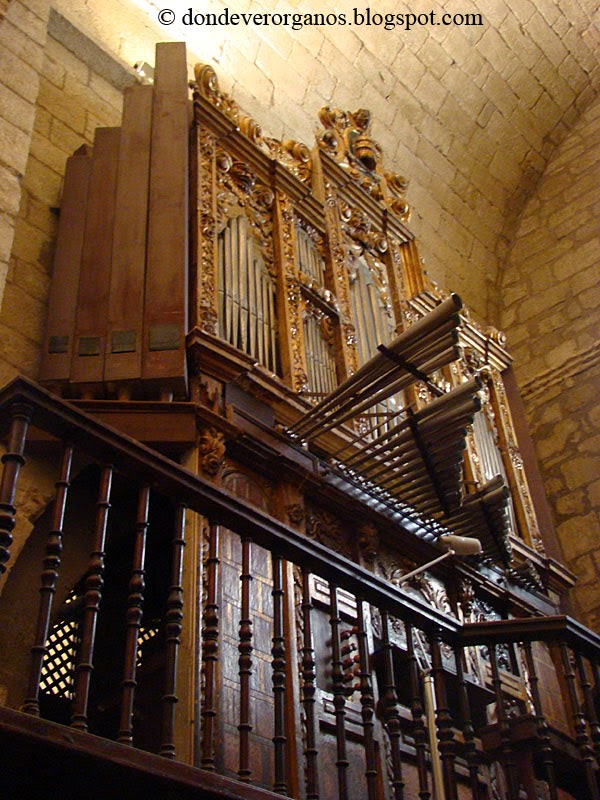
Image resolution: width=600 pixels, height=800 pixels. I want to click on grid window, so click(54, 652).